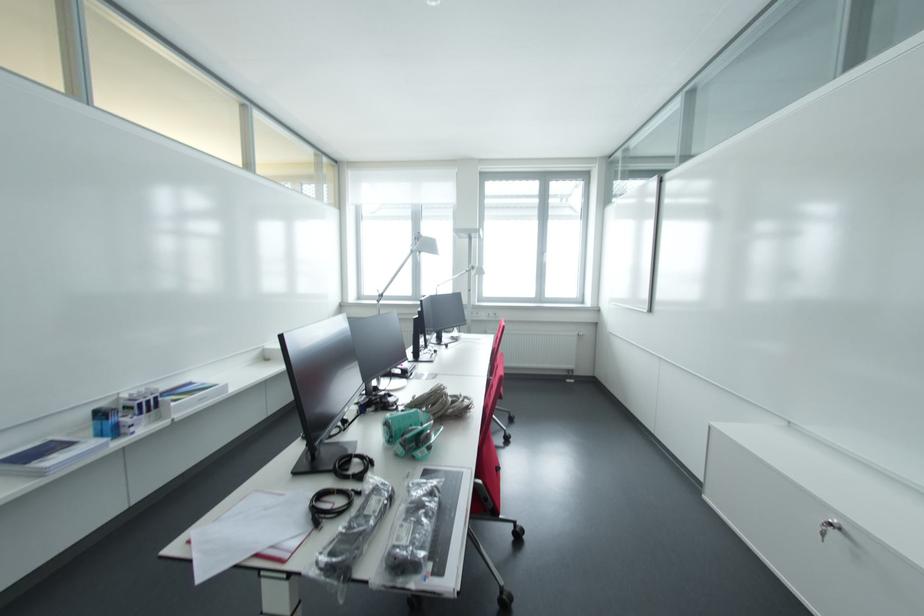
Where is `small blue box`? The image size is (924, 616). small blue box is located at coordinates (104, 422).